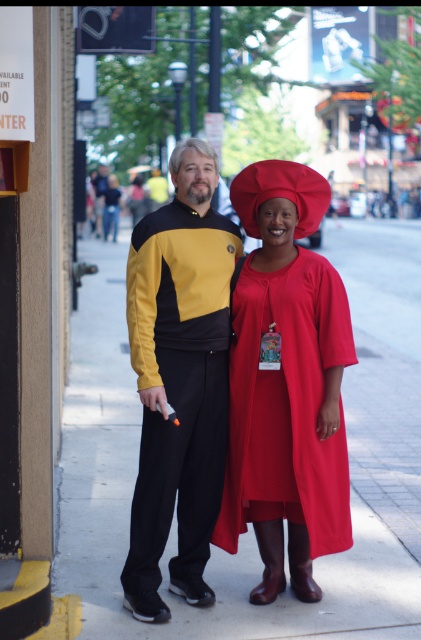
Based on the photo, you are a photographer trying to capture a photo of both the Starfleet uniform person and the person in the red outfit. You want to ensure that both subjects are in focus. Given their positions at point [239,189] and point [175,385] respectively, which subject should you focus on first to maximize the chances of both being sharp?

You should focus on the person at point [239,189] first because it is closer to the viewer than the person at point [175,385]. By focusing on the closer subject, the farther one will also likely be within the depth of field, ensuring both are sharp.

You are a delivery drone operator. Your drone is currently hovering above the smooth concrete pavement at center and needs to land on the yellow matte uniform at center. Is this possible?

The smooth concrete pavement at center is above the yellow matte uniform at center, so the drone cannot land on the yellow matte uniform at center because it is positioned below the pavement.